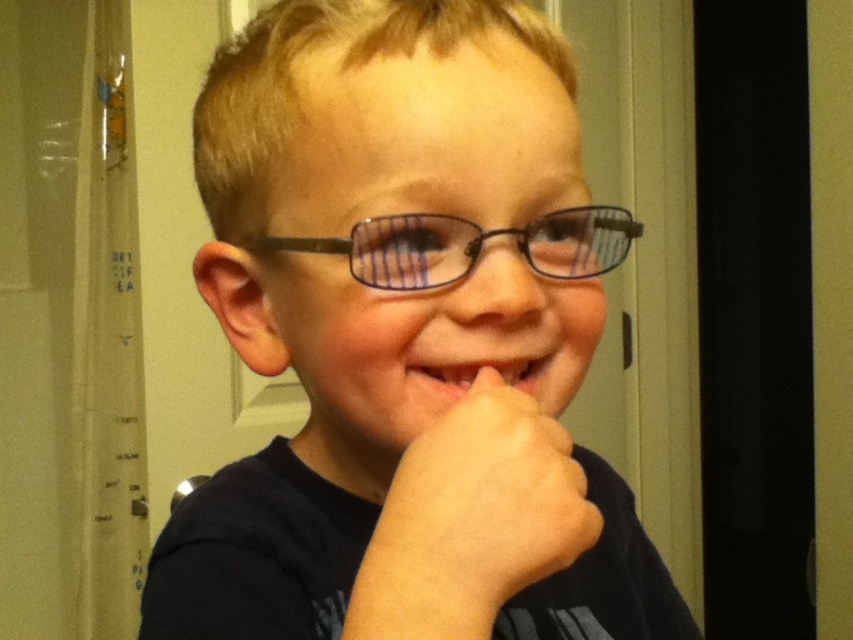
You are a child who wants to put their glasses back on but can only reach a certain distance. The glasses are matte black glasses at center and black plastic glasses at center. Which pair can they reach if their maximum reach is 2.8 inches?

The child cannot reach either pair of glasses because both matte black glasses at center and black plastic glasses at center are 2.91 inches apart, which exceeds the child maximum reach of 2.8 inches.

You are a photographer taking a portrait of the child. You notice the black plastic glasses at center and the pink glossy lips at center. Which object is closer to the bottom of the image?

The black plastic glasses at center is shorter than pink glossy lips at center, meaning it is positioned lower in the image and closer to the bottom.

You are a robot trying to locate two points in the image. The first point is at coordinates point (460,227) and the second point is at coordinates point (538,234). Which point is closer to you?

Point (460,227) is in front of point (538,234), so it is closer to you.